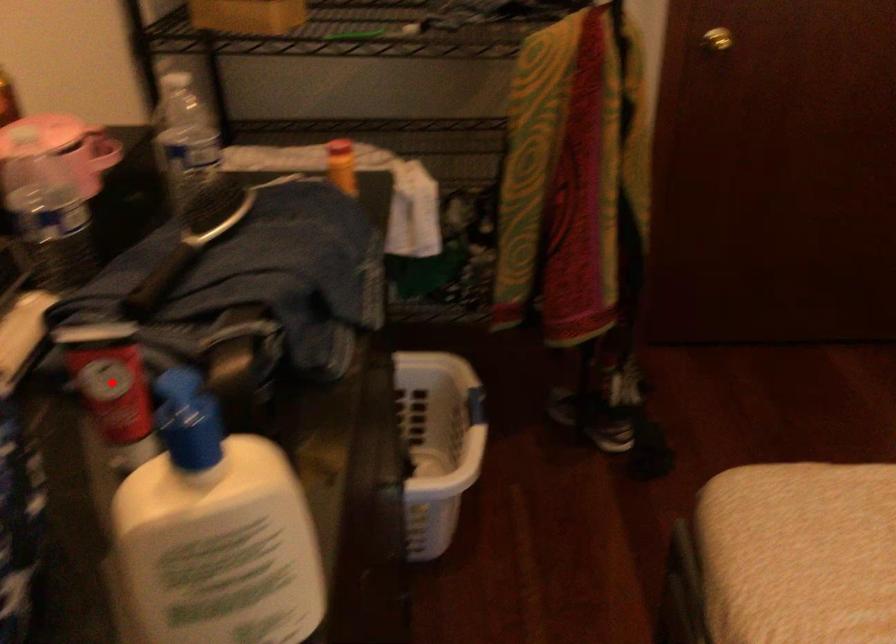
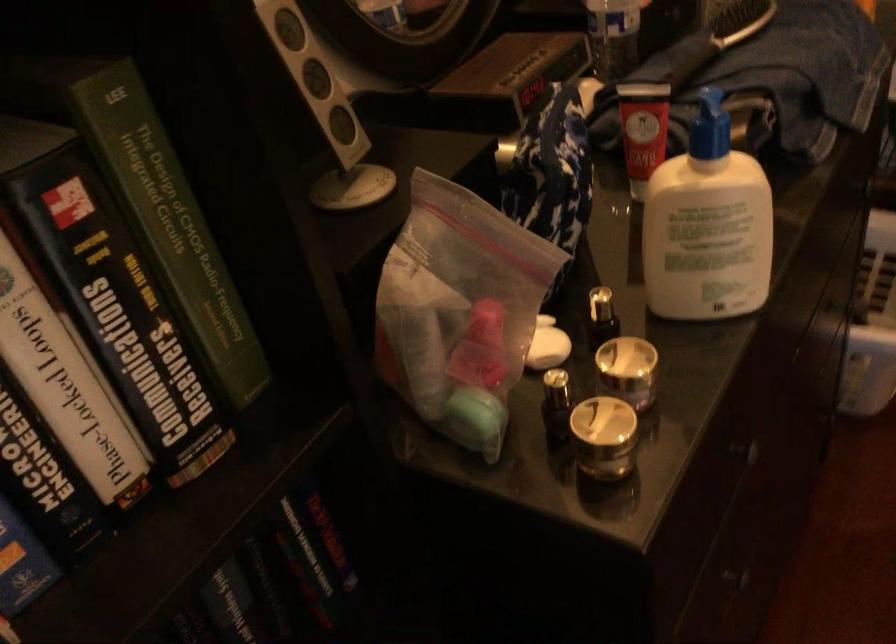
In the second image, find the point that corresponds to the highlighted location in the first image.

(642, 129)